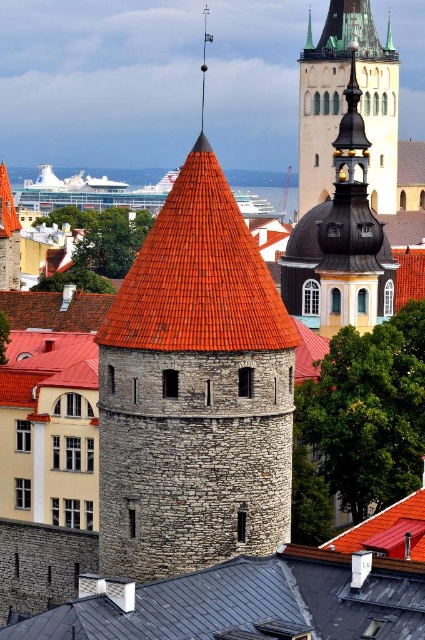
Question: Can you confirm if red tiled roof at center is thinner than gold textured dome at upper center?

Choices:
 (A) yes
 (B) no

Answer: (A)

Question: Which point appears farthest from the camera in this image?

Choices:
 (A) (374, 61)
 (B) (65, 612)

Answer: (A)

Question: Which point appears farthest from the camera in this image?

Choices:
 (A) (326, 65)
 (B) (345, 580)
 (C) (195, 182)

Answer: (A)

Question: Estimate the real-world distances between objects in this image. Which object is farther from the gold textured dome at upper center?

Choices:
 (A) green glass spire at upper center
 (B) red tiled roof at center
 (C) black metal roof at center

Answer: (C)

Question: Can you confirm if black metal roof at center is positioned to the left of gold textured dome at upper center?

Choices:
 (A) yes
 (B) no

Answer: (A)

Question: Is red tiled roof at center to the right of green glass spire at upper center from the viewer's perspective?

Choices:
 (A) yes
 (B) no

Answer: (B)